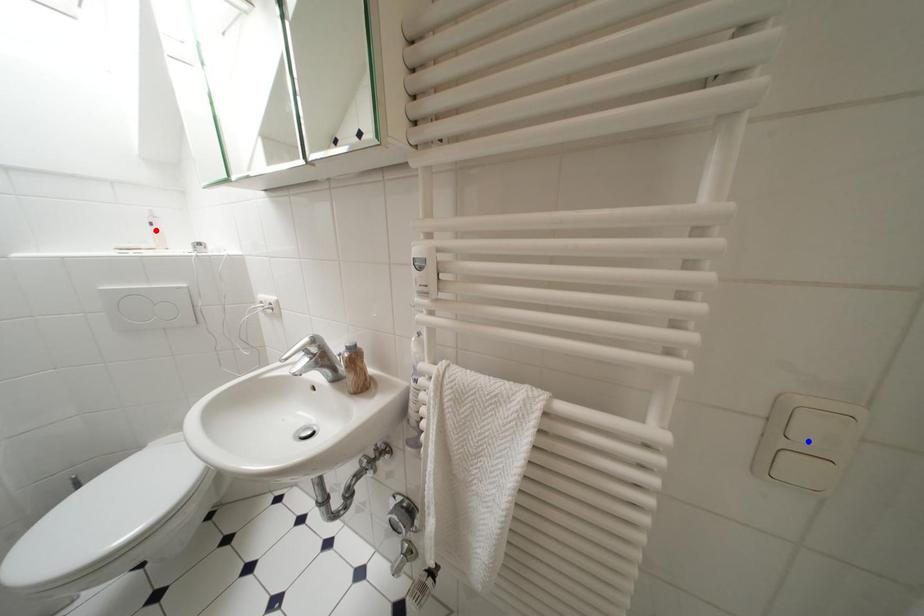
Question: In the image, two points are highlighted. Which point is nearer to the camera? Reply with the corresponding letter.

Choices:
 (A) blue point
 (B) red point

Answer: (A)